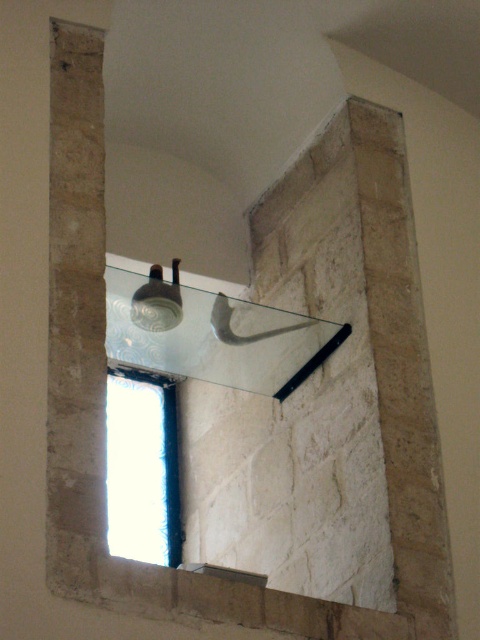
From the picture: Is the position of clear glass mirror at upper center more distant than that of transparent glass window at center?

No, it is in front of transparent glass window at center.

Based on the photo, is clear glass mirror at upper center closer to the viewer compared to transparent glass window at center?

Yes, it is in front of transparent glass window at center.

Does point (149, 305) lie in front of point (111, 528)?

That is True.

I want to click on clear glass mirror at upper center, so click(213, 336).

Measure the distance from clear glass mirror at upper center to matte glass lamp at upper center.

The distance of clear glass mirror at upper center from matte glass lamp at upper center is 32.91 inches.

Is clear glass mirror at upper center further to camera compared to matte glass lamp at upper center?

No, clear glass mirror at upper center is in front of matte glass lamp at upper center.

Which is behind, point (257, 332) or point (152, 289)?

The point (257, 332) is more distant.

Identify the location of clear glass mirror at upper center. The width and height of the screenshot is (480, 640). (213, 336).

Does transparent glass window at center have a lesser width compared to matte glass lamp at upper center?

Yes, transparent glass window at center is thinner than matte glass lamp at upper center.

From the picture: Who is more forward, (149,442) or (148,324)?

Positioned in front is point (148,324).

At what (x,y) coordinates should I click in order to perform the action: click on transparent glass window at center. Please return your answer as a coordinate pair (x, y). This screenshot has width=480, height=640. Looking at the image, I should click on (143, 467).